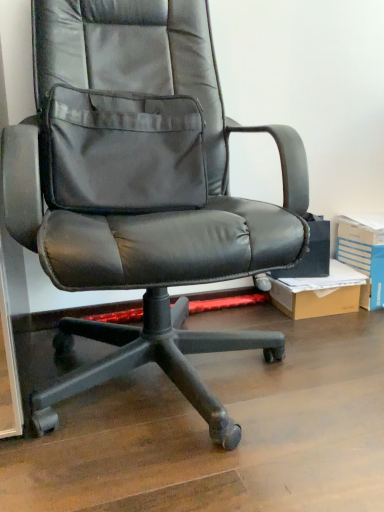
Locate an element on the screen. This screenshot has height=512, width=384. brown cardboard box at lower right is located at coordinates (319, 293).

What is the approximate width of blue cardboard box at right?

10.30 inches.

The height and width of the screenshot is (512, 384). In order to click on brown cardboard box at lower right in this screenshot , I will do `click(319, 293)`.

Is blue cardboard box at right to the left of black leather office chair at center from the viewer's perspective?

No, blue cardboard box at right is not to the left of black leather office chair at center.

Which is in front, blue cardboard box at right or black leather office chair at center?

black leather office chair at center is in front.

From the picture: Is blue cardboard box at right wider than black leather office chair at center?

No, blue cardboard box at right is not wider than black leather office chair at center.

Does blue cardboard box at right have a larger size compared to brown cardboard box at lower right?

Yes.

Is blue cardboard box at right aimed at brown cardboard box at lower right?

No, blue cardboard box at right is not aimed at brown cardboard box at lower right.

Is blue cardboard box at right not near brown cardboard box at lower right?

No.

Is black leather office chair at center oriented away from blue cardboard box at right?

No, black leather office chair at center is not facing away from blue cardboard box at right.

From the image's perspective, is black leather office chair at center under blue cardboard box at right?

Incorrect, from the image's perspective, black leather office chair at center is higher than blue cardboard box at right.

From a real-world perspective, is black leather office chair at center on blue cardboard box at right?

Yes, from a real-world perspective, black leather office chair at center is over blue cardboard box at right

Considering the sizes of objects black leather office chair at center and blue cardboard box at right in the image provided, who is thinner, black leather office chair at center or blue cardboard box at right?

With smaller width is blue cardboard box at right.

From the image's perspective, between black leather office chair at center and brown cardboard box at lower right, which one is located above?

From the image's view, black leather office chair at center is above.

From a real-world perspective, is black leather office chair at center above or below brown cardboard box at lower right?

black leather office chair at center is above brown cardboard box at lower right.

Is black leather office chair at center directly adjacent to brown cardboard box at lower right?

No, black leather office chair at center is not next to brown cardboard box at lower right.

Is black leather office chair at center smaller than brown cardboard box at lower right?

No, black leather office chair at center is not smaller than brown cardboard box at lower right.

What's the angular difference between brown cardboard box at lower right and blue cardboard box at right's facing directions?

0.00037 degrees.

From the image's perspective, is brown cardboard box at lower right under blue cardboard box at right?

Yes.

Measure the distance between brown cardboard box at lower right and blue cardboard box at right.

brown cardboard box at lower right is 5.21 inches from blue cardboard box at right.

Between brown cardboard box at lower right and blue cardboard box at right, which one appears on the left side from the viewer's perspective?

brown cardboard box at lower right.

How much distance is there between brown cardboard box at lower right and black leather office chair at center?

brown cardboard box at lower right and black leather office chair at center are 23.56 inches apart from each other.

From a real-world perspective, is brown cardboard box at lower right physically located above or below black leather office chair at center?

From a real-world perspective, brown cardboard box at lower right is physically below black leather office chair at center.

This screenshot has width=384, height=512. In order to click on cardboard box below the black leather office chair at center (from the image's perspective) in this screenshot , I will do (x=319, y=293).

Which object is thinner, brown cardboard box at lower right or black leather office chair at center?

Thinner between the two is brown cardboard box at lower right.

This screenshot has width=384, height=512. I want to click on paperback book that is behind the black leather office chair at center, so [363, 256].

Identify the location of cardboard box on the left of blue cardboard box at right. (319, 293).

Considering their positions, is black leather office chair at center positioned closer to blue cardboard box at right than brown cardboard box at lower right?

brown cardboard box at lower right is closer to blue cardboard box at right.

Looking at the image, which one is located further to blue cardboard box at right, brown cardboard box at lower right or black leather office chair at center?

The object further to blue cardboard box at right is black leather office chair at center.

From the image, which object appears to be farther from black leather office chair at center, brown cardboard box at lower right or blue cardboard box at right?

blue cardboard box at right is positioned further to the anchor black leather office chair at center.

When comparing their distances from black leather office chair at center, does blue cardboard box at right or brown cardboard box at lower right seem closer?

brown cardboard box at lower right.

Based on their spatial positions, is blue cardboard box at right or black leather office chair at center closer to brown cardboard box at lower right?

The object closer to brown cardboard box at lower right is blue cardboard box at right.

Based on their spatial positions, is black leather office chair at center or blue cardboard box at right further from brown cardboard box at lower right?

Based on the image, black leather office chair at center appears to be further to brown cardboard box at lower right.

The height and width of the screenshot is (512, 384). I want to click on cardboard box located between black leather office chair at center and blue cardboard box at right in the depth direction, so click(x=319, y=293).